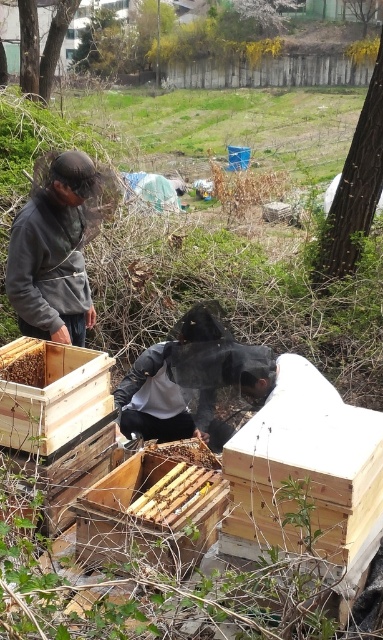
You are a beekeeper who wants to inspect the wooden beehive at center and the brown wooden beehive at lower left. Which beehive should you check first if you want to start from the higher position?

The brown wooden beehive at lower left is higher than the wooden beehive at center, so you should check the brown wooden beehhive at lower left first.

You are a beekeeper who needs to move the wooden beehive at center and the brown wooden beehive at lower left to a new location. Based on their positions in the current scene, which beehive is closer to the right edge of the image?

The wooden beehive at center is positioned on the right side of brown wooden beehive at lower left, so the wooden beehive at center is closer to the right edge of the image.

You are standing in the beekeeping area and need to reach both the point at coordinates point (14,380) and point (178,456). Which point should you reach first to minimize the distance walked?

You should reach point (14,380) first because it is closer to you than point (178,456).